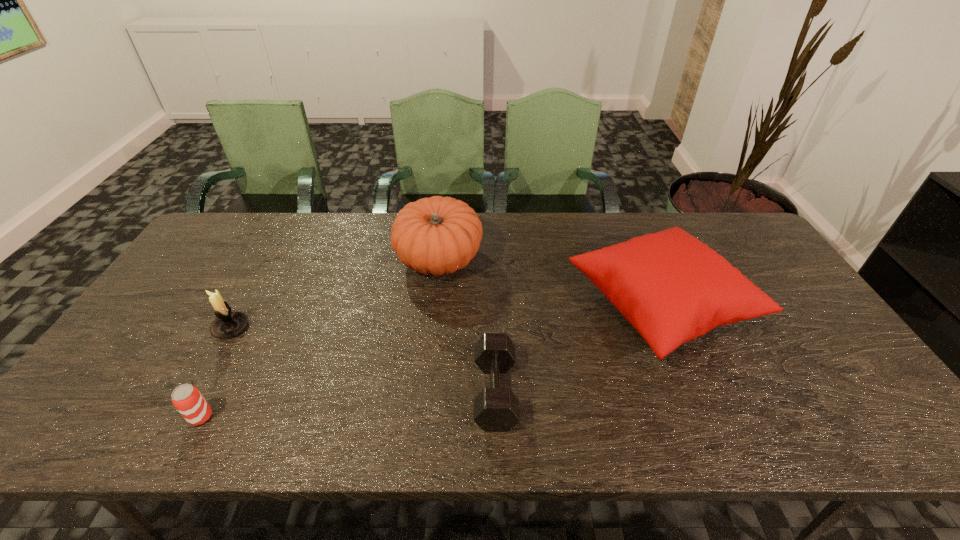
Select which object is the second closest to the beer can. Please provide its 2D coordinates. Your answer should be formatted as a tuple, i.e. [(x, y)], where the tuple contains the x and y coordinates of a point satisfying the conditions above.

[(438, 235)]

What are the coordinates of `object that stands as the fourth closest to the beer can` in the screenshot? It's located at (671, 287).

At what (x,y) coordinates should I click in order to perform the action: click on free space that satisfies the following two spatial constraints: 1. on the front side of the candle holder; 2. on the right side of the beer can. Please return your answer as a coordinate pair (x, y). Looking at the image, I should click on (181, 417).

Where is `blank space that satisfies the following two spatial constraints: 1. on the back side of the beer can; 2. on the right side of the pumpkin`? blank space that satisfies the following two spatial constraints: 1. on the back side of the beer can; 2. on the right side of the pumpkin is located at coordinates (282, 259).